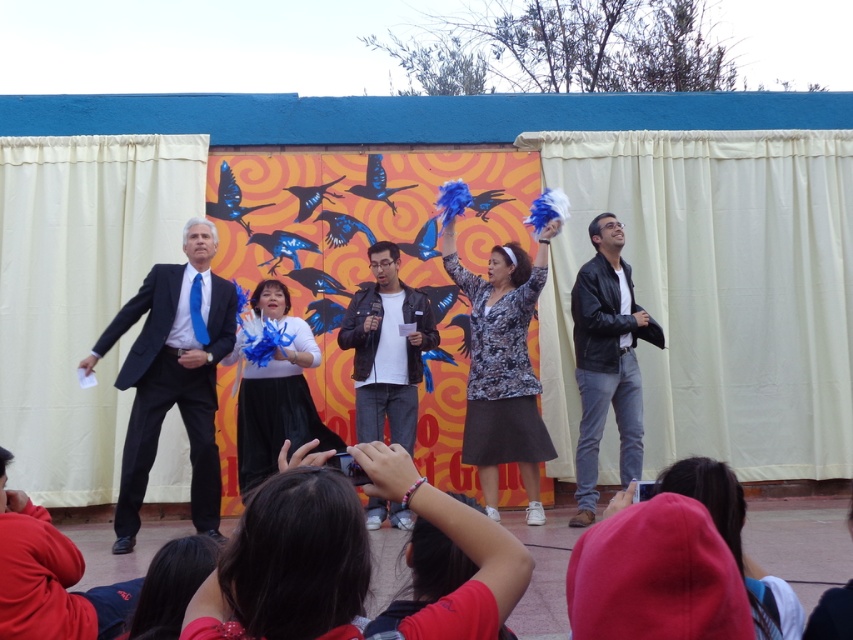
Question: Which point is closer to the camera?

Choices:
 (A) matte black suit at left
 (B) leather jacket at center
 (C) black leather jacket at center
 (D) matte red shirt at lower center

Answer: (A)

Question: Among these objects, which one is farthest from the camera?

Choices:
 (A) matte black suit at left
 (B) leather jacket at center
 (C) matte red shirt at lower center
 (D) black leather jacket at center

Answer: (B)

Question: Is matte red shirt at lower center bigger than black leather jacket at center?

Choices:
 (A) yes
 (B) no

Answer: (B)

Question: Which object is positioned farthest from the black leather jacket at center?

Choices:
 (A) leather jacket at center
 (B) matte red shirt at lower center
 (C) matte black suit at left

Answer: (C)

Question: Is matte black suit at left thinner than leather jacket at center?

Choices:
 (A) yes
 (B) no

Answer: (B)

Question: Is matte red shirt at lower center bigger than leather jacket at center?

Choices:
 (A) yes
 (B) no

Answer: (B)